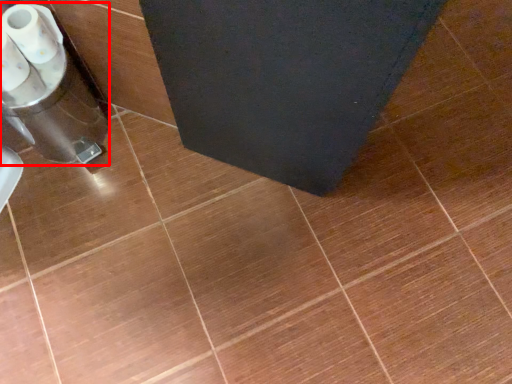
Question: From the image's perspective, where is appliance (annotated by the red box) located in relation to toilet paper in the image?

Choices:
 (A) below
 (B) above

Answer: (A)